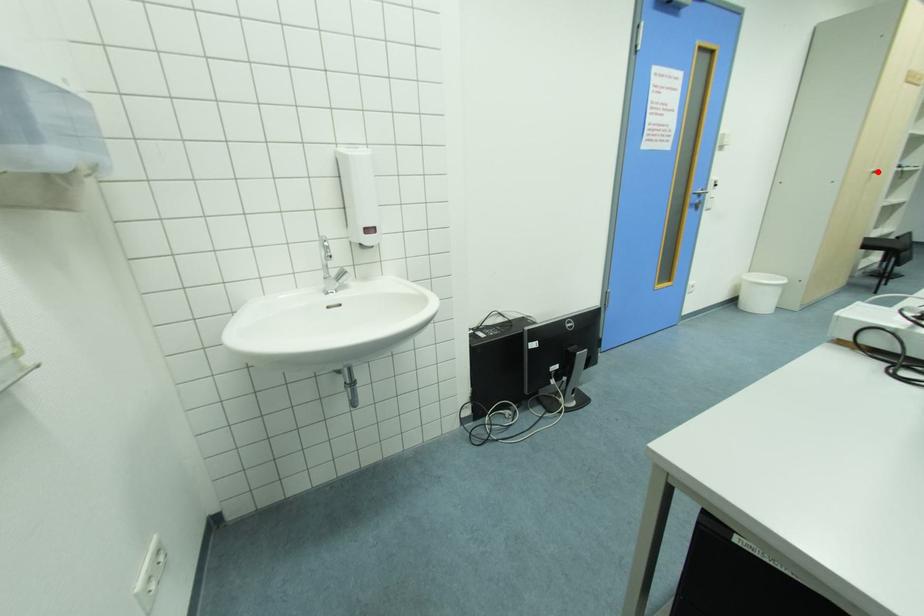
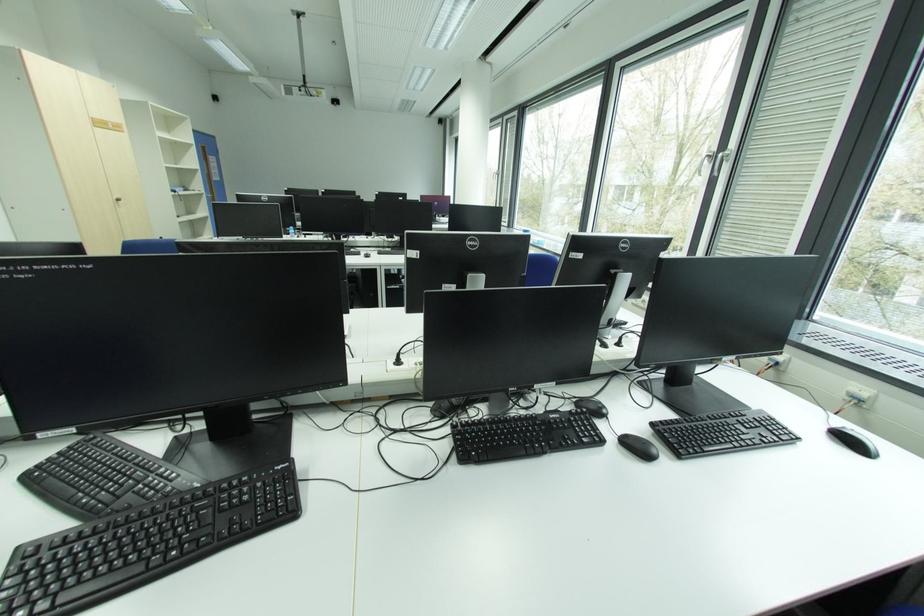
Question: I am providing you with two images of the same scene from different viewpoints. Image1 has a red point marked. In image2, the corresponding 3D location appears at what relative position? Reply with the corresponding letter.

Choices:
 (A) Closer
 (B) Farther

Answer: (A)